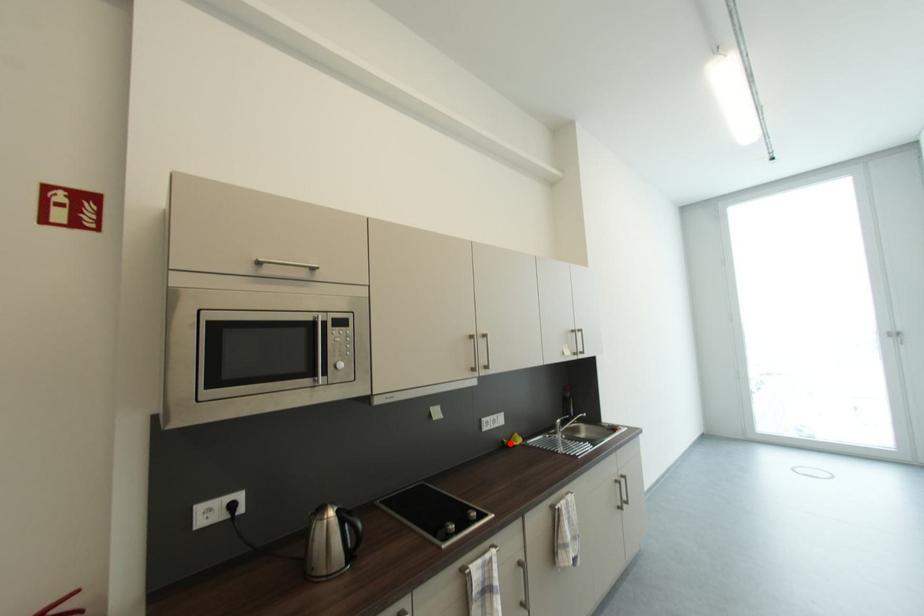
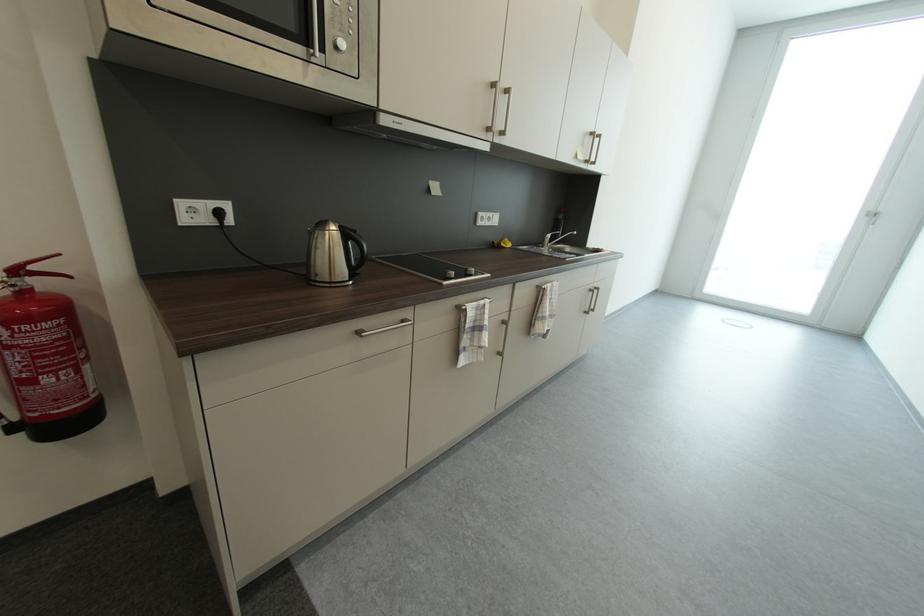
Question: I am providing you with two images of the same scene from different viewpoints. Given a red point in image1, look at the same physical point in image2. Is it:

Choices:
 (A) Closer to the viewpoint
 (B) Farther from the viewpoint

Answer: (A)